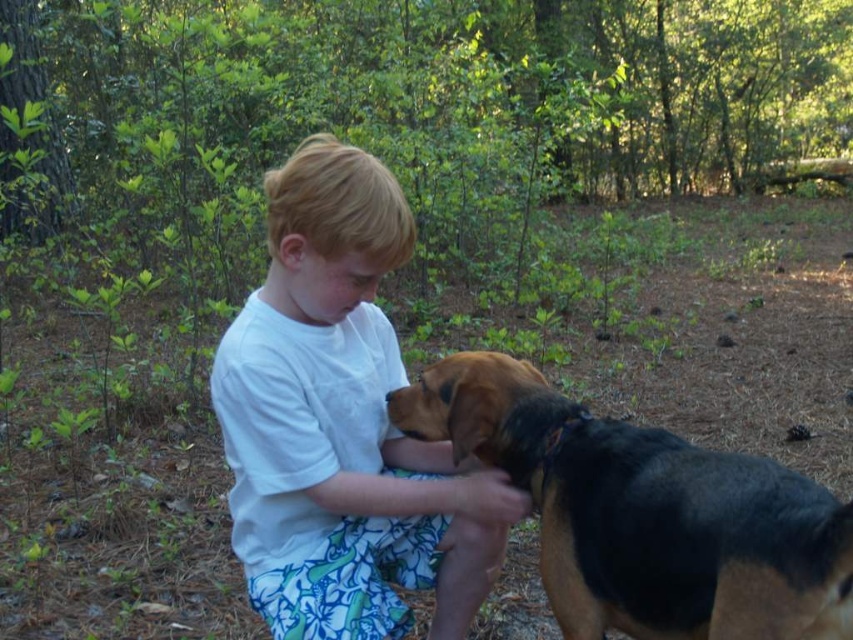
Is white cotton shirt at center positioned before black and tan fur at center?

No, it is behind black and tan fur at center.

Describe the element at coordinates (341, 424) in the screenshot. I see `white cotton shirt at center` at that location.

Identify the location of white cotton shirt at center. The height and width of the screenshot is (640, 853). (341, 424).

The width and height of the screenshot is (853, 640). In order to click on white cotton shirt at center in this screenshot , I will do `click(341, 424)`.